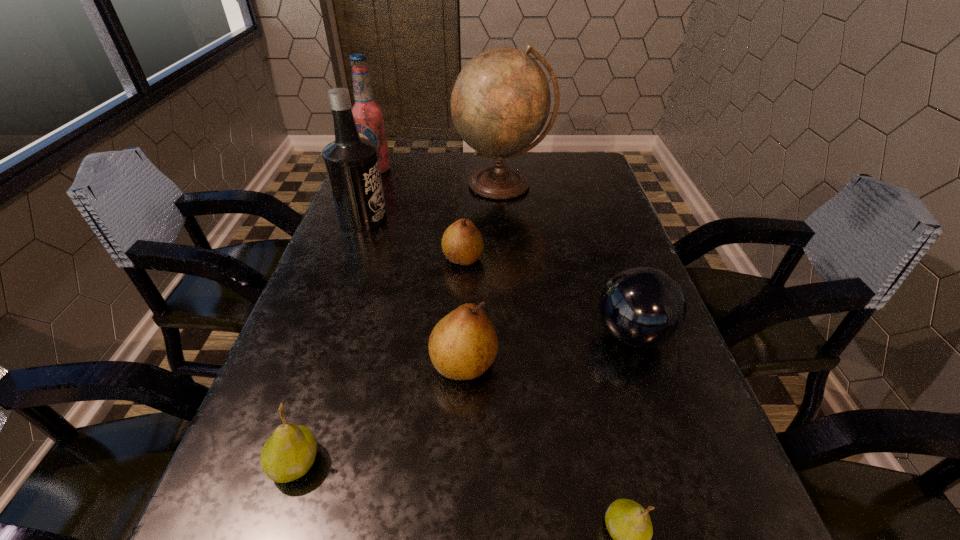
You are a GUI agent. You are given a task and a screenshot of the screen. Output one action in this format:
    pyautogui.click(x=<x>, y=<y>)
    Task: Click on the free location located 0.200m on the front-facing side of the globe
    This screenshot has width=960, height=540.
    Given the screenshot: What is the action you would take?
    pyautogui.click(x=507, y=253)

The image size is (960, 540). Identify the location of vacant area situated on the front label of the liquor. (455, 219).

What are the coordinates of `free space located 0.110m on the front of the blue alcohol` in the screenshot? It's located at (367, 196).

You are a GUI agent. You are given a task and a screenshot of the screen. Output one action in this format:
    pyautogui.click(x=<x>, y=<y>)
    Task: Click on the free region located 0.130m on the front of the third nearest pear
    This screenshot has height=540, width=960.
    Given the screenshot: What is the action you would take?
    pyautogui.click(x=461, y=464)

Where is `vacant space situated on the side of the black bowling ball with the finger holes`? vacant space situated on the side of the black bowling ball with the finger holes is located at coordinates (488, 335).

Locate an element on the screen. Image resolution: width=960 pixels, height=540 pixels. free space located on the side of the black bowling ball with the finger holes is located at coordinates (528, 335).

Where is `vacant space located 0.210m on the side of the black bowling ball with the finger holes`? This screenshot has height=540, width=960. vacant space located 0.210m on the side of the black bowling ball with the finger holes is located at coordinates (488, 335).

Where is `vacant space located 0.310m on the front of the smaller brown pear`? vacant space located 0.310m on the front of the smaller brown pear is located at coordinates (458, 385).

The height and width of the screenshot is (540, 960). Identify the location of blank space located 0.170m on the back of the seventh farthest object. (330, 355).

Locate an element on the screen. This screenshot has width=960, height=540. globe that is at the far edge is located at coordinates (500, 102).